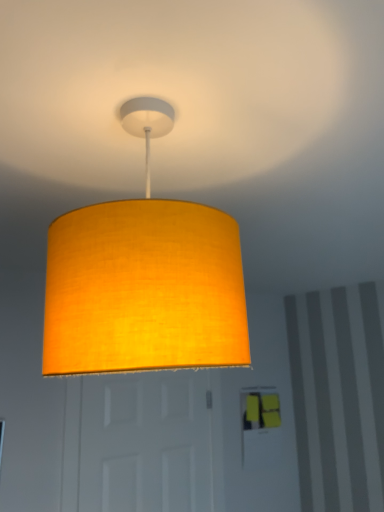
Question: From the image's perspective, relative to matte yellow fabric lampshade at upper center, is white matte door at center above or below?

Choices:
 (A) below
 (B) above

Answer: (A)

Question: Which is correct: white matte door at center is inside matte yellow fabric lampshade at upper center, or outside of it?

Choices:
 (A) outside
 (B) inside

Answer: (A)

Question: From a real-world perspective, is white matte door at center physically located above or below matte yellow fabric lampshade at upper center?

Choices:
 (A) below
 (B) above

Answer: (A)

Question: Relative to white matte door at center, is matte yellow fabric lampshade at upper center in front or behind?

Choices:
 (A) front
 (B) behind

Answer: (A)

Question: From the image's perspective, is matte yellow fabric lampshade at upper center positioned above or below white matte door at center?

Choices:
 (A) above
 (B) below

Answer: (A)

Question: In the image, is matte yellow fabric lampshade at upper center on the left side or the right side of white matte door at center?

Choices:
 (A) right
 (B) left

Answer: (A)

Question: In terms of height, does matte yellow fabric lampshade at upper center look taller or shorter compared to white matte door at center?

Choices:
 (A) short
 (B) tall

Answer: (A)